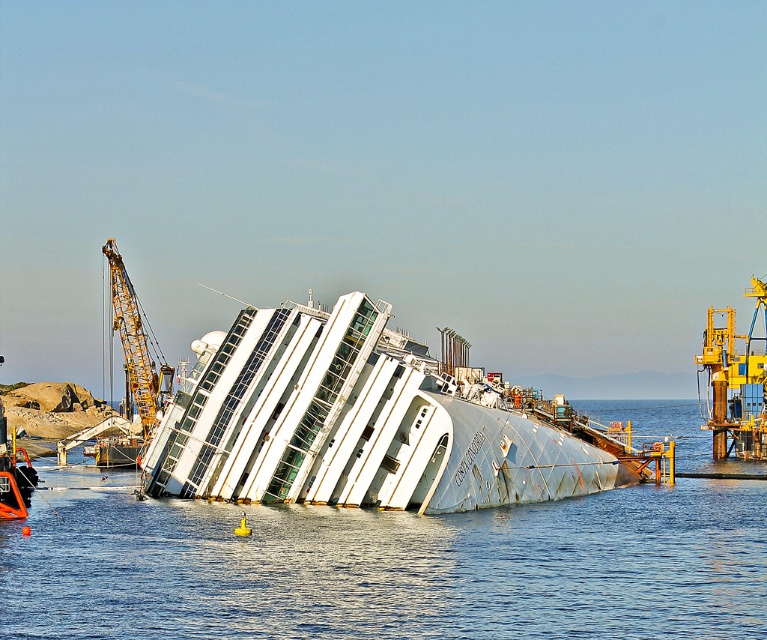
In the scene shown: You are a salvage worker on Giglio Island and need to place a buoy in the clear blue water at center. According to the coordinates provided, where exactly should you place it?

The clear blue water at center is located at point (387, 566), so you should place the buoy at those coordinates.

You are a salvage worker on Giglio Island and need to place a marker at the point closer to the salvage machinery. Which point should you choose between point (412, 580) and point (137, 348)?

Point (412, 580) is in front of point (137, 348), so it is closer to the salvage machinery positioned around the ship. Choose point (412, 580).

You are an engineer assessing the salvage operation of the Costa Concordia. You need to determine if the yellow metallic crane at upper left can handle the width of the white metallic ship at center. Based on the scene, can the crane accommodate the ship?

The white metallic ship at center is wider than the yellow metallic crane at upper left, so the crane cannot accommodate the ship due to its narrower width compared to the ship.